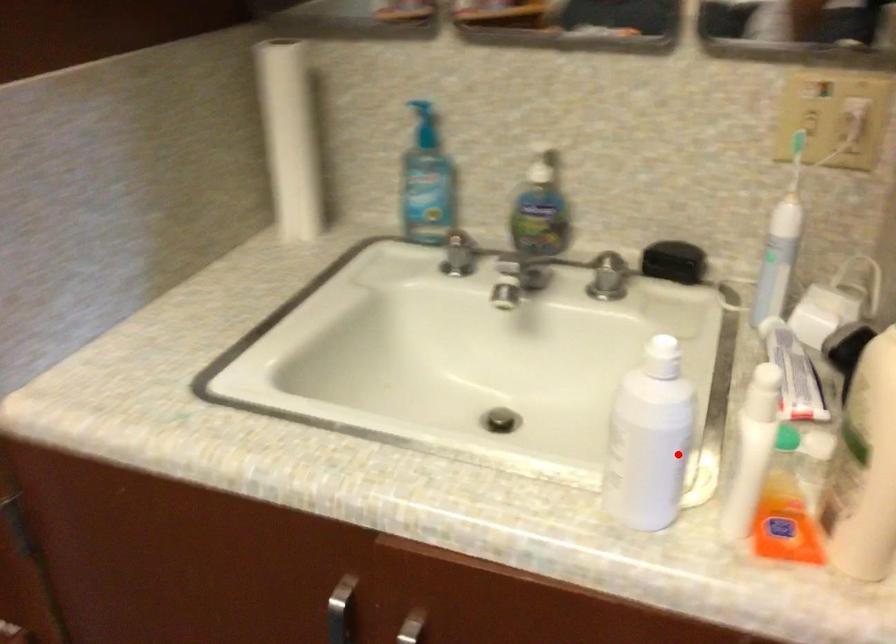
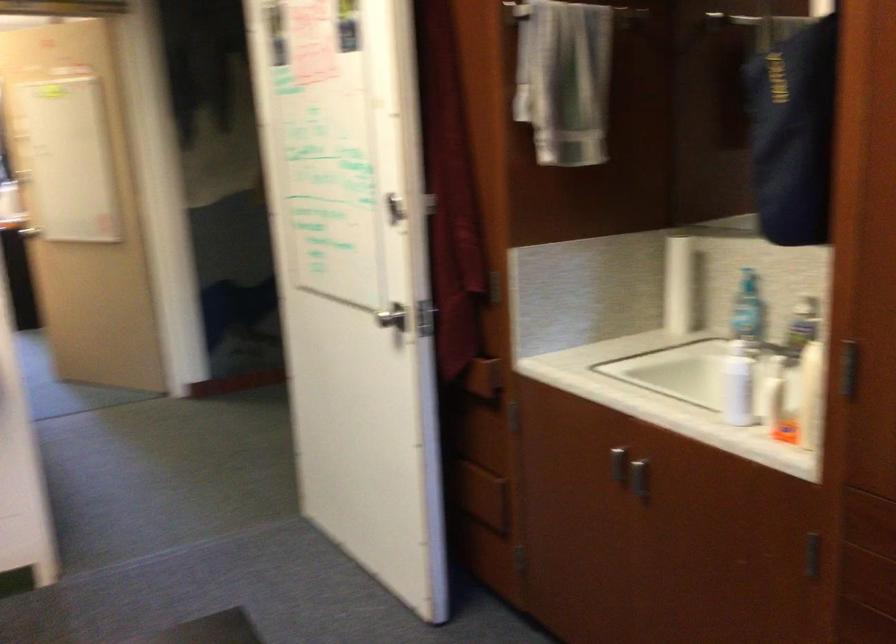
In the second image, find the point that corresponds to the highlighted location in the first image.

(737, 384)